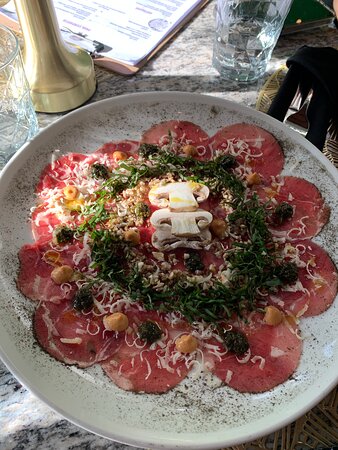
The height and width of the screenshot is (450, 338). In order to click on table in this screenshot , I will do `click(27, 415)`.